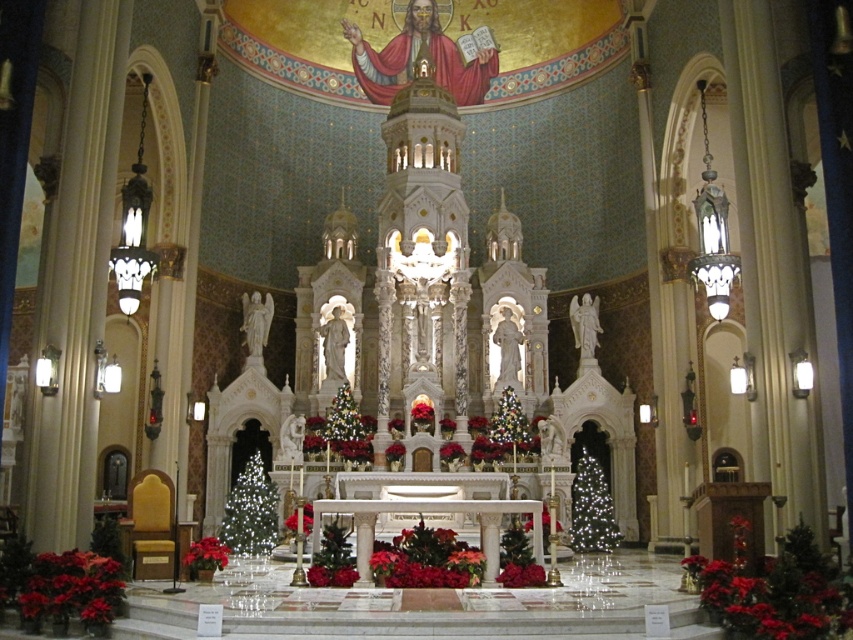
Question: Is illuminated glass christmas tree at lower left closer to the viewer compared to illuminated glass christmas tree at right?

Choices:
 (A) no
 (B) yes

Answer: (B)

Question: Can you confirm if illuminated glass christmas tree at lower left is positioned above illuminated glass christmas tree at right?

Choices:
 (A) yes
 (B) no

Answer: (B)

Question: Which point appears farthest from the camera in this image?

Choices:
 (A) (221, 532)
 (B) (503, 444)
 (C) (589, 483)

Answer: (B)

Question: Is illuminated glass christmas tree at lower left wider than shiny metallic tree at center?

Choices:
 (A) yes
 (B) no

Answer: (A)

Question: Which object is the closest to the shiny metallic tree at center?

Choices:
 (A) illuminated glass christmas tree at lower left
 (B) illuminated glass christmas tree at right

Answer: (B)

Question: Which of the following is the farthest from the observer?

Choices:
 (A) (601, 525)
 (B) (521, 435)

Answer: (B)